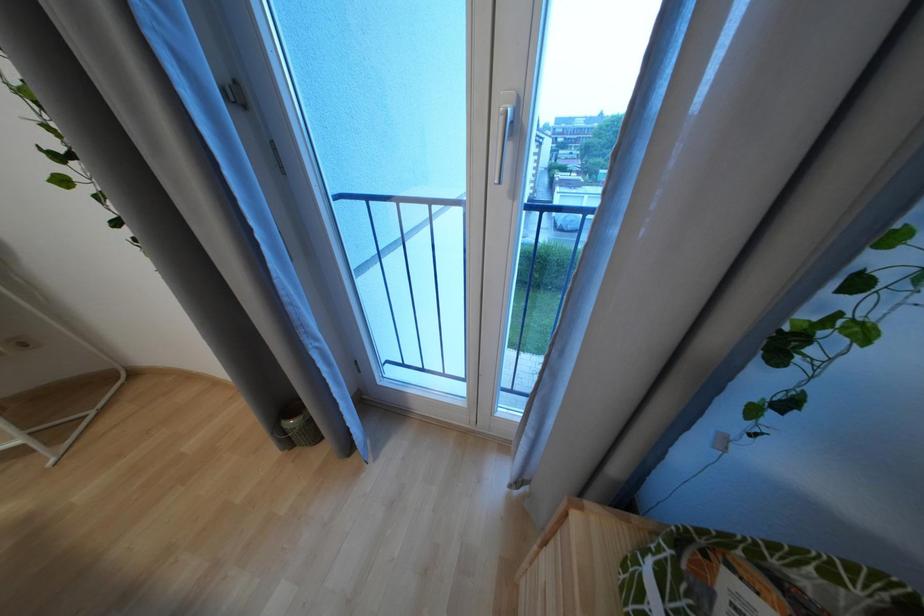
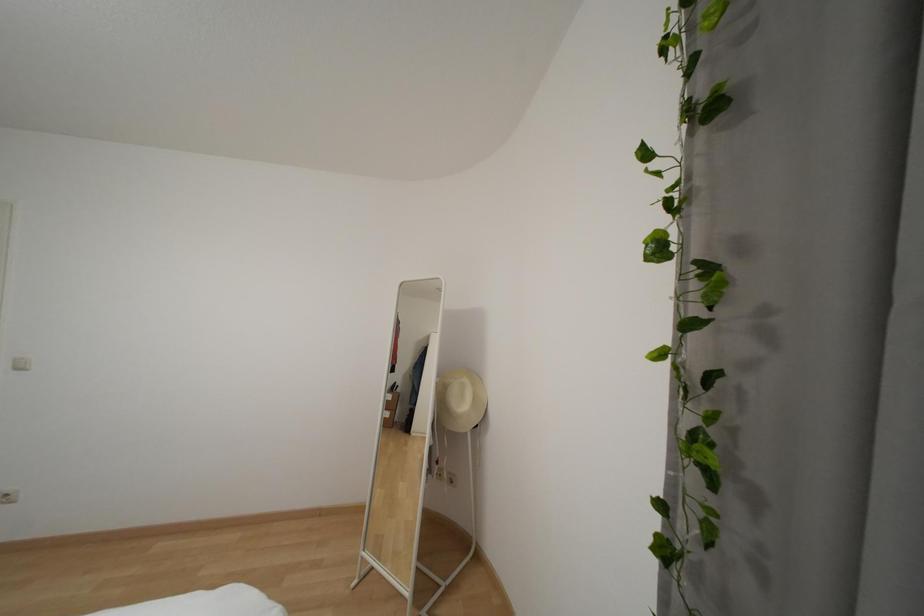
First-person continuous shooting, in which direction is the camera rotating?

The camera's rotation is toward left-up.